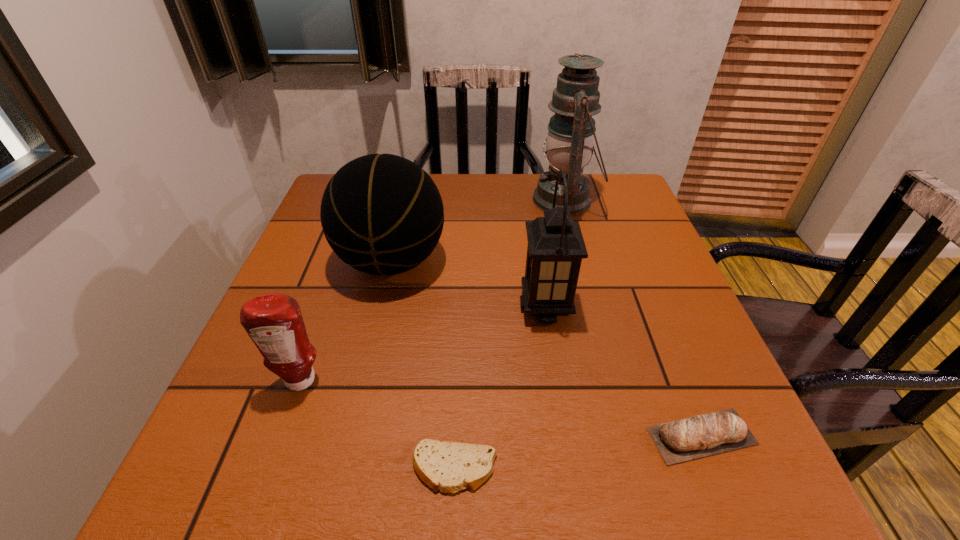
At what (x,y) coordinates should I click in order to perform the action: click on the farthest object. Please return your answer as a coordinate pair (x, y). Looking at the image, I should click on pyautogui.click(x=571, y=131).

Find the location of a particular element. The width and height of the screenshot is (960, 540). oil lamp is located at coordinates (571, 131).

This screenshot has width=960, height=540. I want to click on the fifth shortest object, so click(556, 247).

Find the location of a particular element. This screenshot has height=540, width=960. basketball is located at coordinates (382, 214).

You are a GUI agent. You are given a task and a screenshot of the screen. Output one action in this format:
    pyautogui.click(x=<x>, y=<y>)
    Task: Click on the condiment
    The image size is (960, 540).
    Given the screenshot: What is the action you would take?
    pyautogui.click(x=274, y=322)

Where is `the fourth farthest object`? The image size is (960, 540). the fourth farthest object is located at coordinates (274, 322).

Find the location of a particular element. The height and width of the screenshot is (540, 960). the taller pita bread is located at coordinates tap(703, 435).

Identify the location of the right pita bread. The height and width of the screenshot is (540, 960). (703, 435).

The width and height of the screenshot is (960, 540). In order to click on the left pita bread in this screenshot , I will do `click(449, 467)`.

Where is `the shorter pita bread`? This screenshot has width=960, height=540. the shorter pita bread is located at coordinates (449, 467).